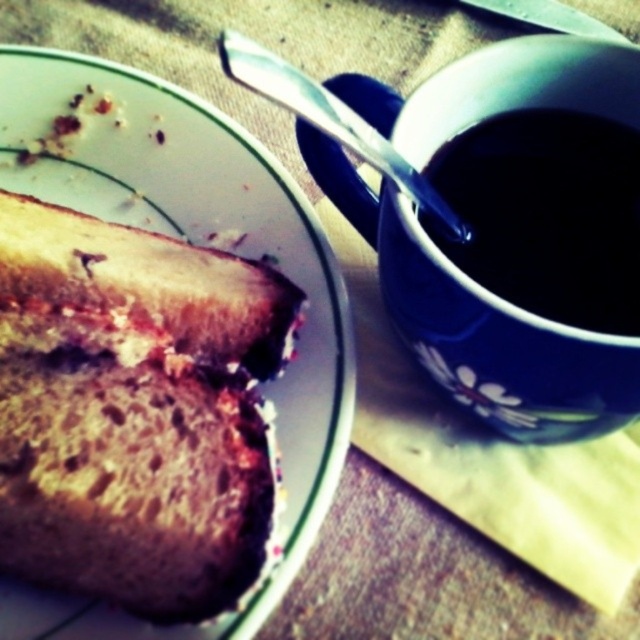
Which is more to the left, dark matte cup at upper right or brown crumbly bread at center?

brown crumbly bread at center is more to the left.

Is dark matte cup at upper right bigger than brown crumbly bread at center?

Actually, dark matte cup at upper right might be smaller than brown crumbly bread at center.

Who is more forward, (438, 192) or (104, 244)?

Point (438, 192)

You are a GUI agent. You are given a task and a screenshot of the screen. Output one action in this format:
    pyautogui.click(x=<x>, y=<y>)
    Task: Click on the dark matte cup at upper right
    
    Given the screenshot: What is the action you would take?
    pyautogui.click(x=547, y=214)

Can you confirm if white glossy plate at upper left is wider than silver metallic fork at upper center?

Correct, the width of white glossy plate at upper left exceeds that of silver metallic fork at upper center.

Who is higher up, white glossy plate at upper left or silver metallic fork at upper center?

silver metallic fork at upper center is above.

Locate an element on the screen. white glossy plate at upper left is located at coordinates (195, 243).

Find the location of a particular element. The image size is (640, 640). white glossy plate at upper left is located at coordinates (195, 243).

Which of these two, white glossy plate at upper left or brown crumbly bread at center, stands shorter?

brown crumbly bread at center is shorter.

Can you confirm if white glossy plate at upper left is positioned to the left of brown crumbly bread at center?

Correct, you'll find white glossy plate at upper left to the left of brown crumbly bread at center.

Find the location of a particular element. The height and width of the screenshot is (640, 640). white glossy plate at upper left is located at coordinates (195, 243).

Where is `white glossy plate at upper left`? This screenshot has width=640, height=640. white glossy plate at upper left is located at coordinates (195, 243).